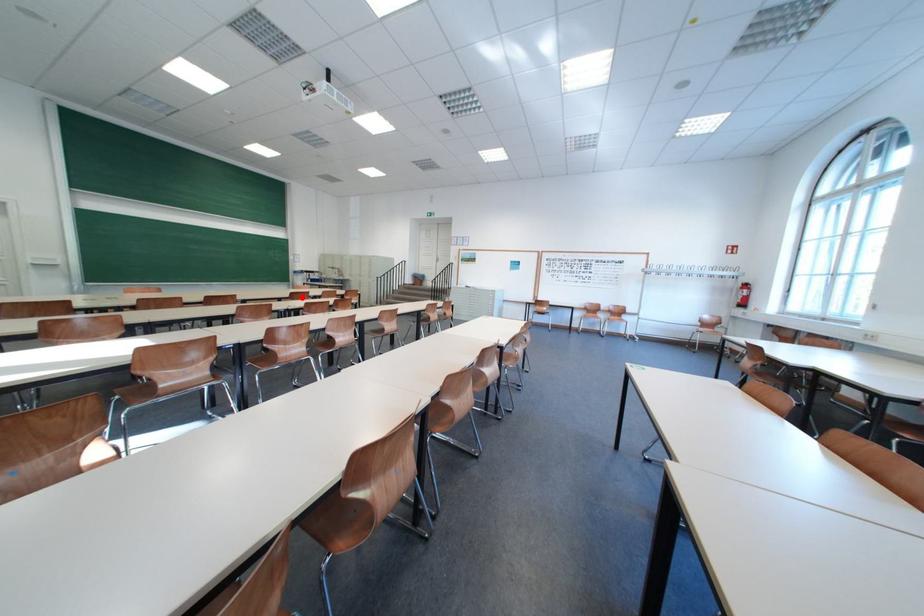
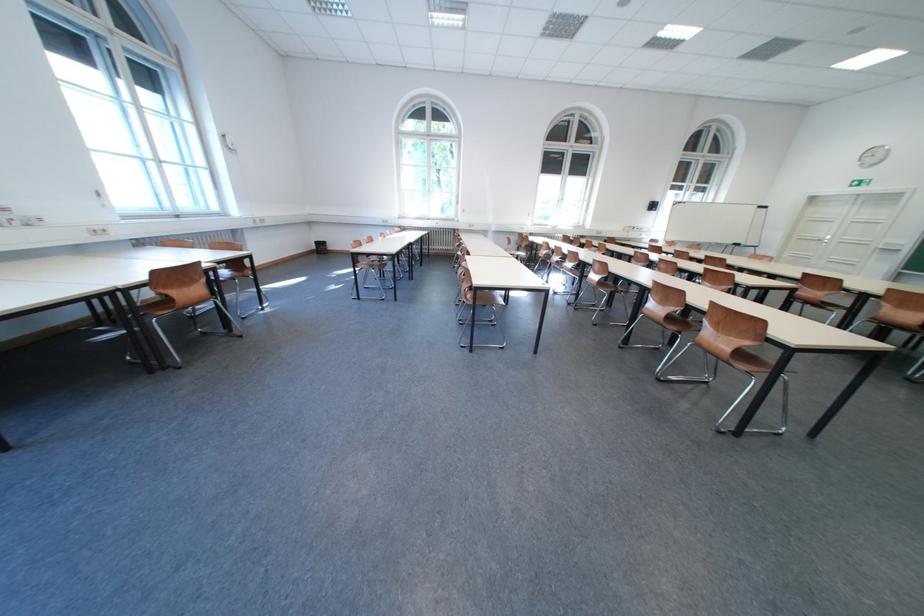
Question: I am providing you with two images of the same scene from different viewpoints. Image1 has a red point marked. In image2, the corresponding 3D location appears at what relative position? Reply with the corresponding letter.

Choices:
 (A) Closer
 (B) Farther

Answer: (A)